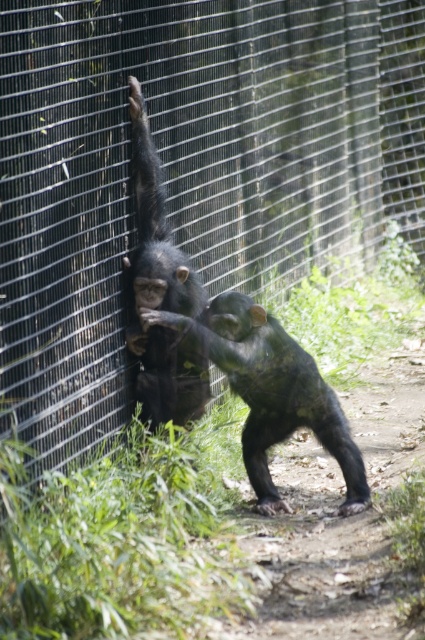
Who is positioned more to the left, dark brown fur monkey at center or shiny black monkey at left?

shiny black monkey at left

Which of these two, dark brown fur monkey at center or shiny black monkey at left, stands taller?

shiny black monkey at left

Does point (340, 429) come in front of point (130, 122)?

No, (340, 429) is further to viewer.

Image resolution: width=425 pixels, height=640 pixels. Identify the location of dark brown fur monkey at center. (269, 390).